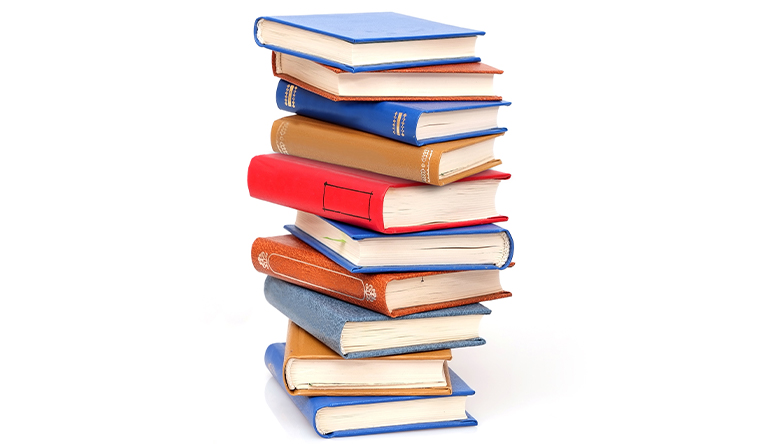
The image size is (760, 444). Find the location of `books`. books is located at coordinates (401, 423), (384, 370), (399, 330), (404, 292), (420, 247), (416, 168), (409, 127), (416, 79), (403, 52).